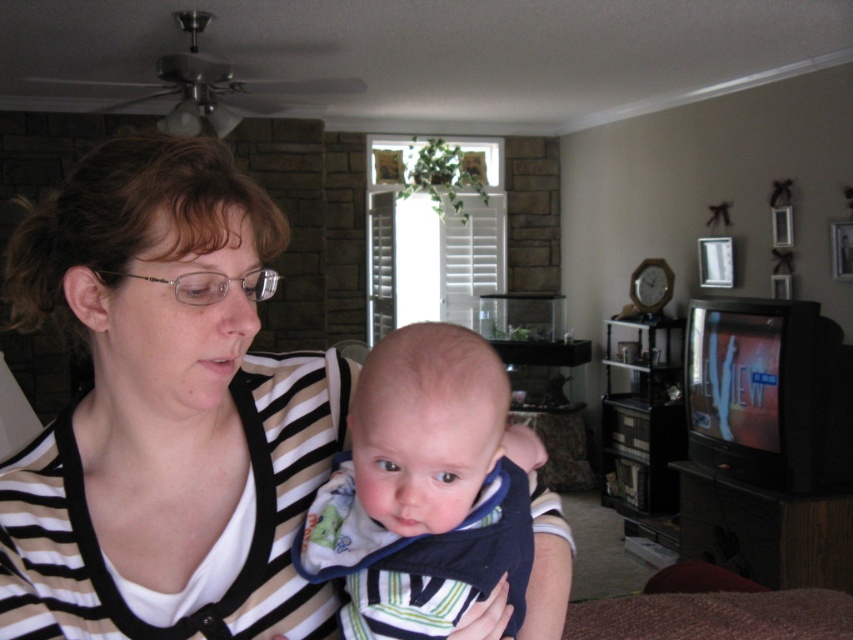
You are a photographer setting up a shoot in this living room. You need to place a small prop exactly at the coordinates mentioned for the striped fabric shirt at center. Where would you position it relative to the woman holding the baby?

The striped fabric shirt at center is located at coordinates point (165, 412), so you should position the prop at that exact point relative to the woman holding the baby.

You are a photographer setting up for a family photo. You notice the striped fabric shirt at center and the striped fabric baby at center in the scene. Which object is positioned to the left of the other?

The striped fabric shirt at center is to the left of the striped fabric baby at center.

You are a tailor who needs to determine which item requires more fabric between the striped fabric shirt at center and the striped fabric baby at center. Based on their sizes, which one would need more fabric?

The striped fabric shirt at center has a larger size compared to striped fabric baby at center, so it would require more fabric.